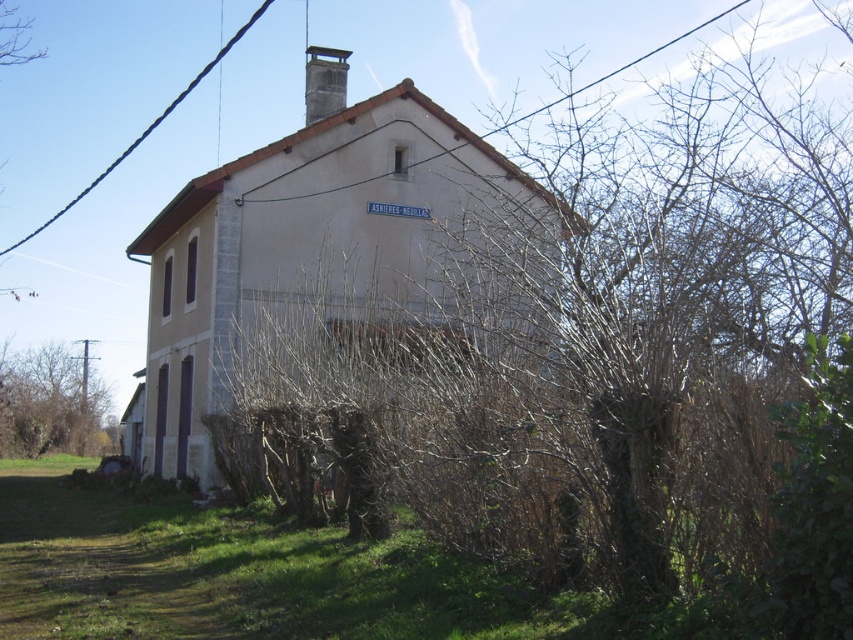
Is point (666, 352) more distant than point (312, 116)?

No, (666, 352) is closer to viewer.

Is point (798, 221) closer to camera compared to point (343, 93)?

That is False.

The height and width of the screenshot is (640, 853). What do you see at coordinates (612, 355) in the screenshot?
I see `brown dry bush at center` at bounding box center [612, 355].

Locate an element on the screen. brown dry bush at center is located at coordinates (612, 355).

Can you confirm if black wire at upper center is smaller than smooth gray chimney at upper center?

No, black wire at upper center is not smaller than smooth gray chimney at upper center.

Who is more distant from viewer, (555, 102) or (326, 52)?

Point (555, 102)

Find the location of a particular element. black wire at upper center is located at coordinates (584, 84).

Can you confirm if brown dry bush at center is thinner than black wire at upper center?

No, brown dry bush at center is not thinner than black wire at upper center.

Is the position of brown dry bush at center more distant than that of black wire at upper center?

No, it is not.

Where is `brown dry bush at center`? This screenshot has width=853, height=640. brown dry bush at center is located at coordinates (612, 355).